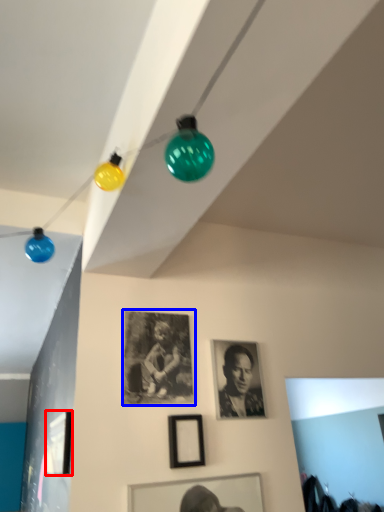
Question: Which object is closer to the camera taking this photo, picture frame (highlighted by a red box) or picture frame (highlighted by a blue box)?

Choices:
 (A) picture frame
 (B) picture frame

Answer: (A)